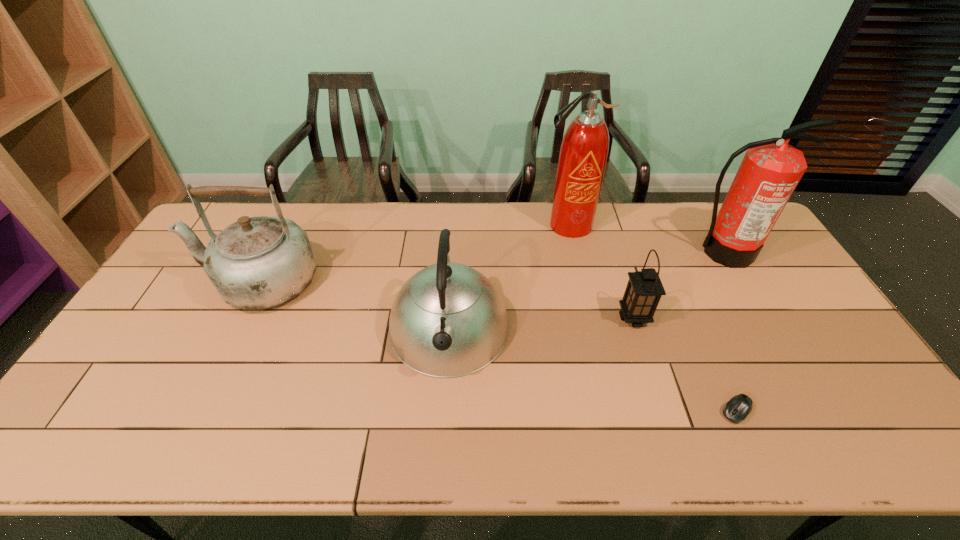
I want to click on vacant space located 0.180m on the front side of the rightmost object, so click(x=757, y=310).

Where is `free space located 0.080m at the spout of the left kettle`? free space located 0.080m at the spout of the left kettle is located at coordinates (177, 281).

You are a GUI agent. You are given a task and a screenshot of the screen. Output one action in this format:
    pyautogui.click(x=<x>, y=<y>)
    Task: Click on the vacant space located 0.060m at the spout of the left kettle
    
    Given the screenshot: What is the action you would take?
    pyautogui.click(x=182, y=281)

At what (x,y) coordinates should I click in order to perform the action: click on free region located 0.130m from the spout of the shorter kettle. Please return your answer as a coordinate pair (x, y). Looking at the image, I should click on (443, 433).

This screenshot has height=540, width=960. Identify the location of vacant area situated on the right of the lantern. (684, 318).

The image size is (960, 540). I want to click on vacant point located on the back of the fifth object from left to right, so click(703, 336).

Where is `object that is at the near edge`? This screenshot has height=540, width=960. object that is at the near edge is located at coordinates (738, 408).

Where is `object at the left edge`? This screenshot has width=960, height=540. object at the left edge is located at coordinates (260, 262).

I want to click on object that is at the right edge, so 771,169.

This screenshot has width=960, height=540. I want to click on object positioned at the far right corner, so click(x=771, y=169).